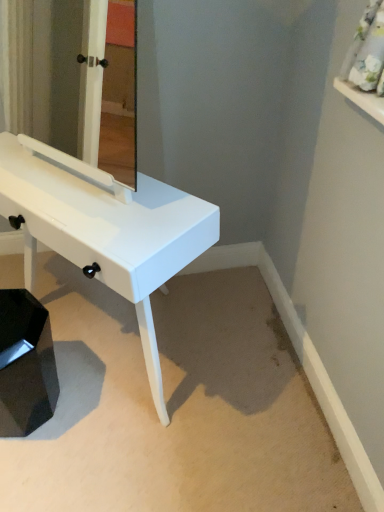
You are a GUI agent. You are given a task and a screenshot of the screen. Output one action in this format:
    pyautogui.click(x=<x>, y=<y>)
    Task: Click on the vacant area that lies to the right of white glossy table at center
    Image resolution: width=384 pixels, height=512 pixels.
    Given the screenshot: What is the action you would take?
    pyautogui.click(x=242, y=385)